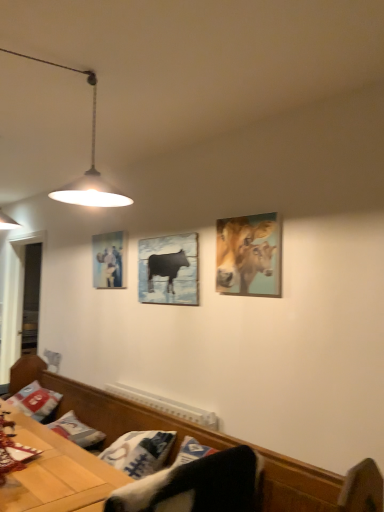
Question: Is metallic pendant light at upper left wider or thinner than matte black cow at center, which ranks as the 1th picture frame in right-to-left order?

Choices:
 (A) wide
 (B) thin

Answer: (A)

Question: From their relative heights in the image, would you say metallic pendant light at upper left is taller or shorter than matte black cow at center, which ranks as the 2th picture frame in back-to-front order?

Choices:
 (A) tall
 (B) short

Answer: (A)

Question: Which is nearer to the golden textured cows at upper right?

Choices:
 (A) black fabric swivel chair at lower center
 (B) matte glass picture frame at upper left, the 2th picture frame in the right-to-left sequence
 (C) matte black cow at center, which is the second picture frame from left to right
 (D) wooden bench at lower center
 (E) metallic pendant light at upper left

Answer: (C)

Question: Which object is positioned farthest from the wooden bench at lower center?

Choices:
 (A) matte black cow at center, which ranks as the 1th picture frame in right-to-left order
 (B) golden textured cows at upper right
 (C) wooden table at lower left
 (D) matte glass picture frame at upper left, placed as the second picture frame when sorted from front to back
 (E) white cotton pillow at lower left

Answer: (D)